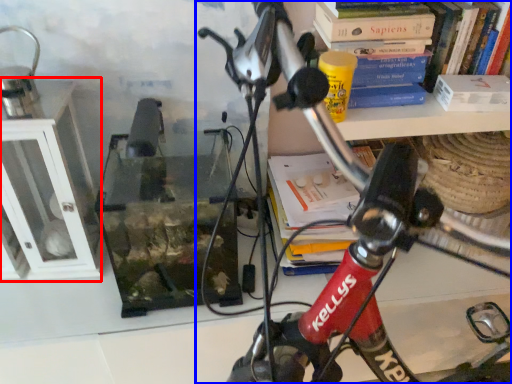
Question: Among these objects, which one is farthest to the camera, shelf (highlighted by a red box) or bicycle (highlighted by a blue box)?

Choices:
 (A) shelf
 (B) bicycle

Answer: (A)